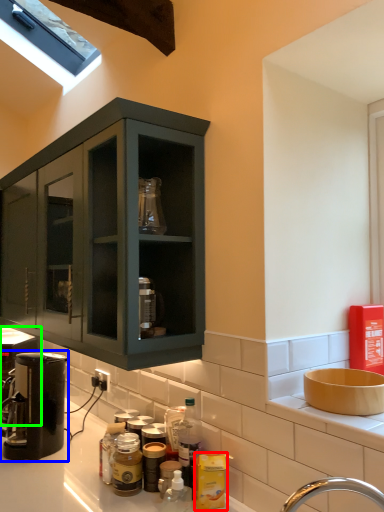
Question: Which is nearer to the bottle (highlighted by a red box)? coffee machine (highlighted by a blue box) or coffee machine (highlighted by a green box).

Choices:
 (A) coffee machine
 (B) coffee machine

Answer: (A)